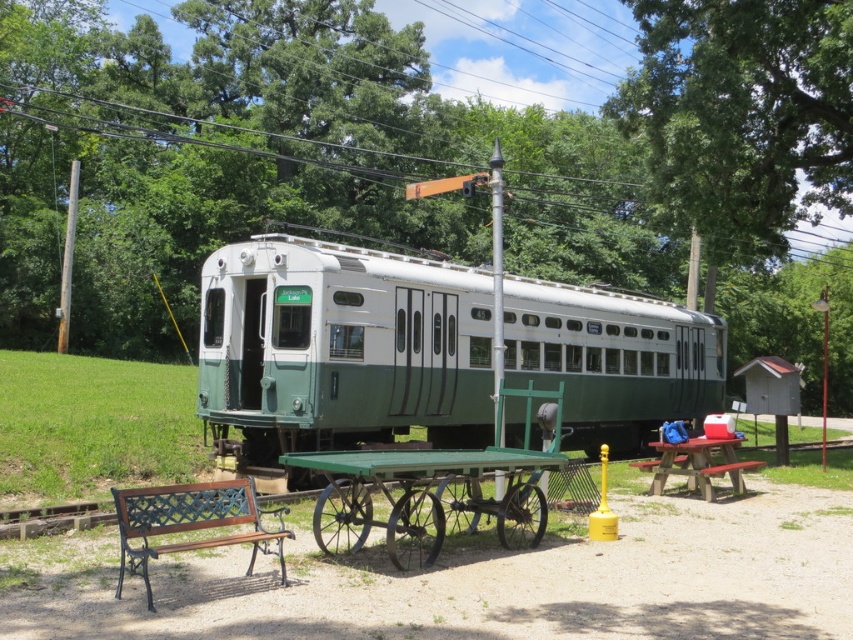
Question: Which of the following is the farthest from the observer?

Choices:
 (A) (142, 109)
 (B) (689, 465)
 (C) (335, 515)
 (D) (228, 244)

Answer: (A)

Question: Which point is farther to the camera?

Choices:
 (A) 364,342
 (B) 583,92
 (C) 733,465

Answer: (B)

Question: Is green matte train car at center thinner than red wood picnic table at center right?

Choices:
 (A) no
 (B) yes

Answer: (A)

Question: In this image, where is green matte train car at center located relative to brown wood bench at lower left?

Choices:
 (A) right
 (B) left

Answer: (A)

Question: Among these objects, which one is nearest to the camera?

Choices:
 (A) brown wood bench at lower left
 (B) green metal cart at center

Answer: (A)

Question: Can you confirm if white plastic power line at upper center is smaller than red wood picnic table at center right?

Choices:
 (A) yes
 (B) no

Answer: (B)